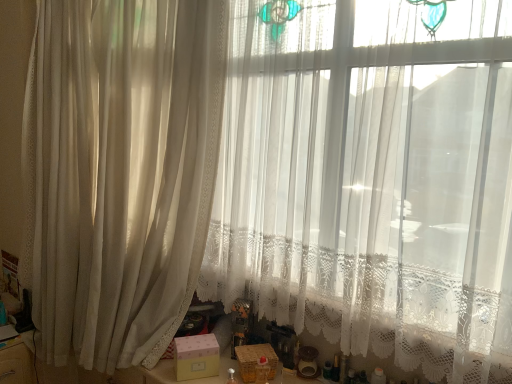
Locate an element on the screen. sheer white curtain at left is located at coordinates (119, 172).

Where is `sheer white curtain at left`? This screenshot has width=512, height=384. sheer white curtain at left is located at coordinates (119, 172).

Is there a large distance between sheer white curtain at left and pink matte box at center, the first box in the left-to-right sequence?

No, sheer white curtain at left is not far from pink matte box at center, the first box in the left-to-right sequence.

Is sheer white curtain at left taller or shorter than pink matte box at center, the first box in the left-to-right sequence?

sheer white curtain at left is taller than pink matte box at center, the first box in the left-to-right sequence.

Considering the relative sizes of sheer white curtain at left and pink matte box at center, the 2th box when ordered from right to left, in the image provided, is sheer white curtain at left bigger than pink matte box at center, the 2th box when ordered from right to left,?

Indeed, sheer white curtain at left has a larger size compared to pink matte box at center, the 2th box when ordered from right to left.

Identify the location of curtain in front of the pink matte box at center, the 2th box when ordered from right to left. The height and width of the screenshot is (384, 512). (119, 172).

Is wooden basket at lower center, marked as the 2th box in a left-to-right arrangement, oriented towards sheer white curtain at left?

No, wooden basket at lower center, marked as the 2th box in a left-to-right arrangement, is not oriented towards sheer white curtain at left.

From the image's perspective, is wooden basket at lower center, which appears as the first box when viewed from the right, located beneath sheer white curtain at left?

Yes, from the image's perspective, wooden basket at lower center, which appears as the first box when viewed from the right, is below sheer white curtain at left.

Which is correct: wooden basket at lower center, marked as the 2th box in a left-to-right arrangement, is inside sheer white curtain at left, or outside of it?

The correct answer is: outside.

Locate an element on the screen. This screenshot has height=384, width=512. curtain that is in front of the wooden basket at lower center, which appears as the first box when viewed from the right is located at coordinates (119, 172).

In terms of size, does pink matte box at center, the 2th box when ordered from right to left, appear bigger or smaller than wooden basket at lower center, marked as the 2th box in a left-to-right arrangement?

In the image, pink matte box at center, the 2th box when ordered from right to left, appears to be larger than wooden basket at lower center, marked as the 2th box in a left-to-right arrangement.

Which of these two, pink matte box at center, the first box in the left-to-right sequence, or wooden basket at lower center, marked as the 2th box in a left-to-right arrangement, stands shorter?

wooden basket at lower center, marked as the 2th box in a left-to-right arrangement.

Which object is closer to the camera taking this photo, pink matte box at center, the first box in the left-to-right sequence, or wooden basket at lower center, marked as the 2th box in a left-to-right arrangement?

wooden basket at lower center, marked as the 2th box in a left-to-right arrangement, is in front.

Which is less distant, (218, 370) or (254, 357)?

The point (218, 370) is closer.

Is pink matte box at center, the 2th box when ordered from right to left, facing towards sheer white curtain at left?

No, pink matte box at center, the 2th box when ordered from right to left, does not turn towards sheer white curtain at left.

Which of these two, pink matte box at center, the 2th box when ordered from right to left, or sheer white curtain at left, stands shorter?

pink matte box at center, the 2th box when ordered from right to left, is shorter.

Could you measure the distance between pink matte box at center, the 2th box when ordered from right to left, and sheer white curtain at left?

They are 25.91 inches apart.

From the image's perspective, would you say pink matte box at center, the 2th box when ordered from right to left, is shown under sheer white curtain at left?

Yes, from the image's perspective, pink matte box at center, the 2th box when ordered from right to left, is below sheer white curtain at left.

Considering the positions of point (272, 351) and point (186, 364), is point (272, 351) closer or farther from the camera than point (186, 364)?

Point (272, 351) appears to be farther away from the viewer than point (186, 364).

Does wooden basket at lower center, which appears as the first box when viewed from the right, have a greater width compared to pink matte box at center, the 2th box when ordered from right to left?

Incorrect, the width of wooden basket at lower center, which appears as the first box when viewed from the right, does not surpass that of pink matte box at center, the 2th box when ordered from right to left.

Looking at this image, looking at the image, does wooden basket at lower center, marked as the 2th box in a left-to-right arrangement, seem bigger or smaller compared to pink matte box at center, the 2th box when ordered from right to left?

wooden basket at lower center, marked as the 2th box in a left-to-right arrangement, is smaller than pink matte box at center, the 2th box when ordered from right to left.

Is the position of sheer white curtain at left less distant than that of wooden basket at lower center, which appears as the first box when viewed from the right?

That is True.

Is sheer white curtain at left facing towards wooden basket at lower center, marked as the 2th box in a left-to-right arrangement?

No, sheer white curtain at left does not turn towards wooden basket at lower center, marked as the 2th box in a left-to-right arrangement.

From a real-world perspective, who is located lower, sheer white curtain at left or wooden basket at lower center, marked as the 2th box in a left-to-right arrangement?

wooden basket at lower center, marked as the 2th box in a left-to-right arrangement.

Is sheer white curtain at left positioned beyond the bounds of wooden basket at lower center, marked as the 2th box in a left-to-right arrangement?

Yes, sheer white curtain at left is located beyond the bounds of wooden basket at lower center, marked as the 2th box in a left-to-right arrangement.

The height and width of the screenshot is (384, 512). I want to click on box that is the 1st object to the right of the sheer white curtain at left, starting at the anchor, so click(x=196, y=357).

Locate an element on the screen. The height and width of the screenshot is (384, 512). curtain lying in front of the wooden basket at lower center, which appears as the first box when viewed from the right is located at coordinates (119, 172).

Which object lies nearer to the anchor point wooden basket at lower center, marked as the 2th box in a left-to-right arrangement, pink matte box at center, the first box in the left-to-right sequence, or sheer white curtain at left?

pink matte box at center, the first box in the left-to-right sequence, lies closer to wooden basket at lower center, marked as the 2th box in a left-to-right arrangement, than the other object.

Which object lies further to the anchor point pink matte box at center, the first box in the left-to-right sequence, wooden basket at lower center, which appears as the first box when viewed from the right, or sheer white curtain at left?

sheer white curtain at left lies further to pink matte box at center, the first box in the left-to-right sequence, than the other object.

From the image, which object appears to be nearer to sheer white curtain at left, pink matte box at center, the first box in the left-to-right sequence, or wooden basket at lower center, marked as the 2th box in a left-to-right arrangement?

pink matte box at center, the first box in the left-to-right sequence, is closer to sheer white curtain at left.

Looking at this image, which object lies further to the anchor point wooden basket at lower center, which appears as the first box when viewed from the right, sheer white curtain at left or pink matte box at center, the 2th box when ordered from right to left?

Based on the image, sheer white curtain at left appears to be further to wooden basket at lower center, which appears as the first box when viewed from the right.

From the image, which object appears to be nearer to pink matte box at center, the first box in the left-to-right sequence, sheer white curtain at left or wooden basket at lower center, marked as the 2th box in a left-to-right arrangement?

Among the two, wooden basket at lower center, marked as the 2th box in a left-to-right arrangement, is located nearer to pink matte box at center, the first box in the left-to-right sequence.

From the image, which object appears to be nearer to sheer white curtain at left, wooden basket at lower center, marked as the 2th box in a left-to-right arrangement, or pink matte box at center, the 2th box when ordered from right to left?

pink matte box at center, the 2th box when ordered from right to left, is closer to sheer white curtain at left.

The image size is (512, 384). Find the location of `box between sheer white curtain at left and wooden basket at lower center, marked as the 2th box in a left-to-right arrangement, from top to bottom`. box between sheer white curtain at left and wooden basket at lower center, marked as the 2th box in a left-to-right arrangement, from top to bottom is located at coordinates (196, 357).